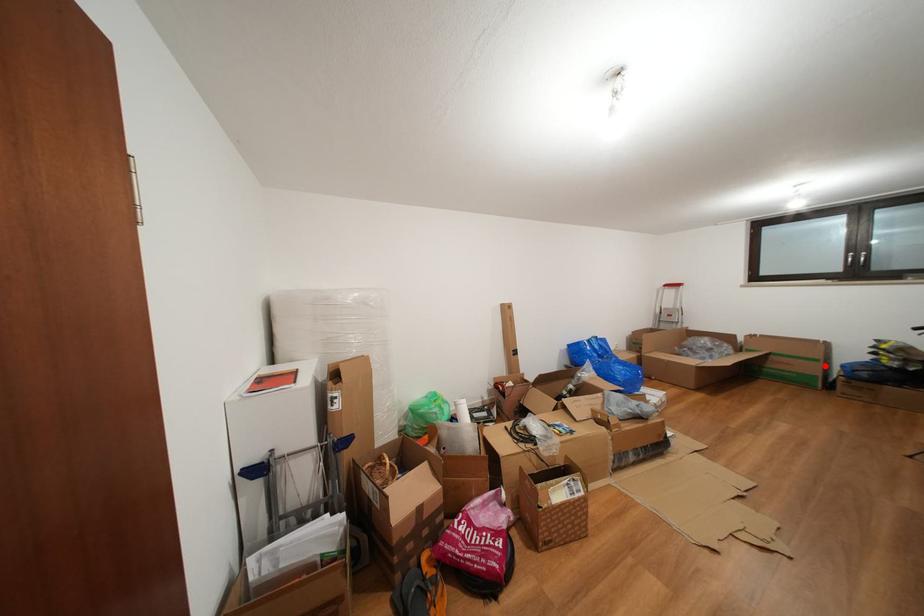
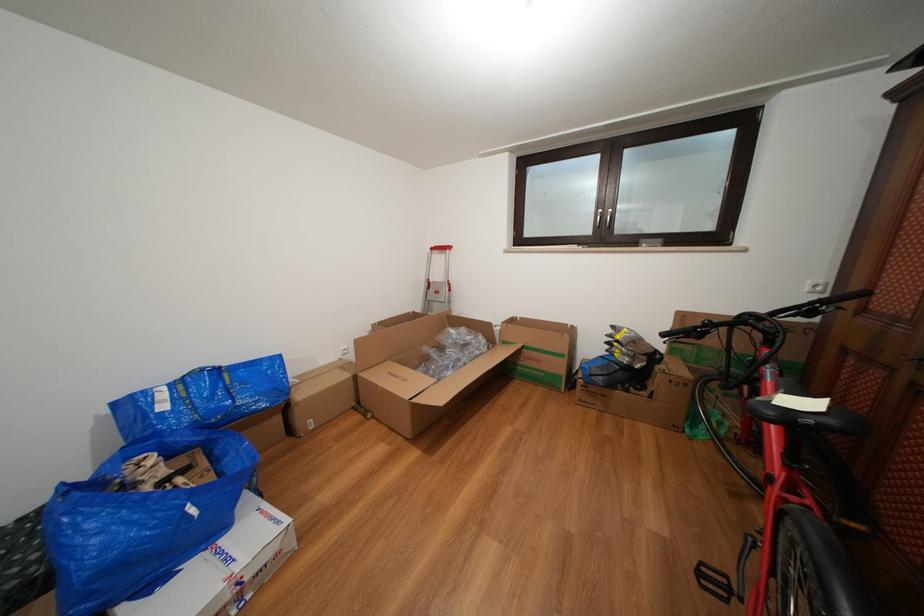
The point at the highlighted location is marked in the first image. Where is the corresponding point in the second image?

(570, 361)